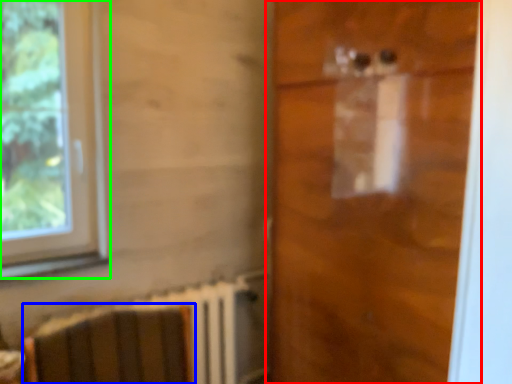
Question: Based on their relative distances, which object is farther from door (highlighted by a red box)? Choose from armchair (highlighted by a blue box) and window (highlighted by a green box).

Choices:
 (A) armchair
 (B) window

Answer: (B)